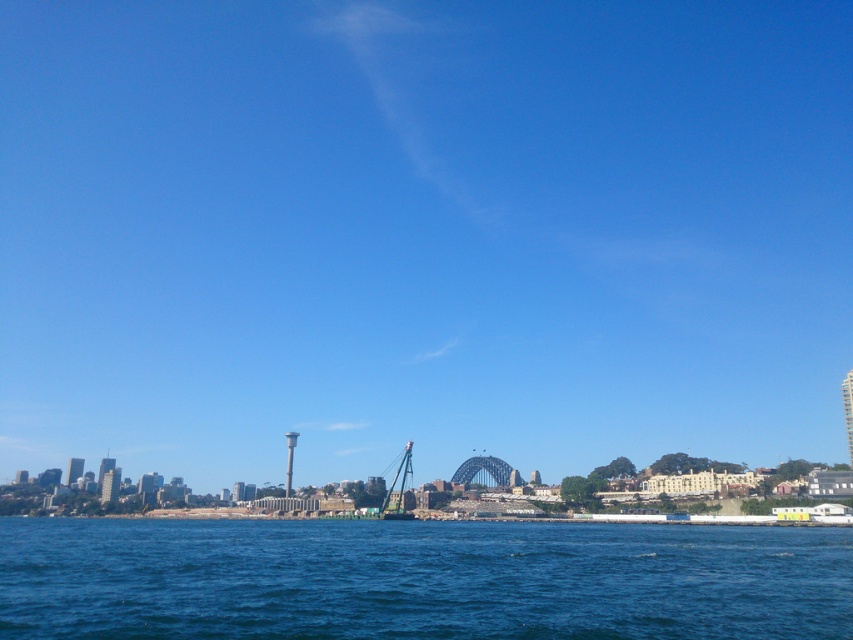
Who is more distant from viewer, (593,557) or (360,502)?

Positioned behind is point (360,502).

Does point (306, 522) lie behind point (407, 518)?

Yes, point (306, 522) is farther from viewer.

The width and height of the screenshot is (853, 640). I want to click on blue liquid water at lower center, so click(419, 579).